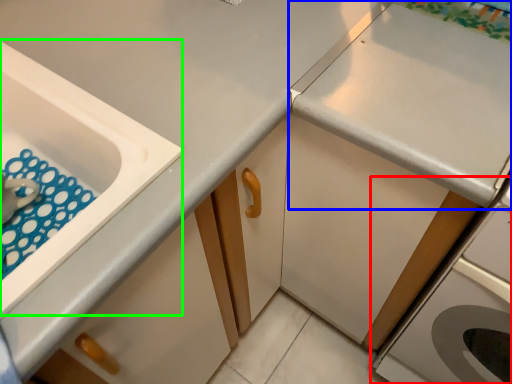
Question: Considering the real-world distances, which object is farthest from home appliance (highlighted by a red box)? countertop (highlighted by a blue box) or sink (highlighted by a green box)?

Choices:
 (A) countertop
 (B) sink

Answer: (B)